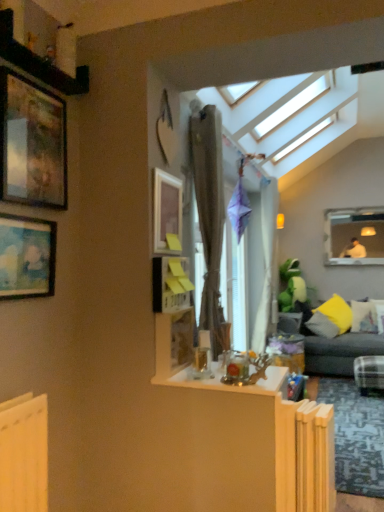
Where is `matte wooden picture frame at upper left, which is counted as the 4th picture frame, starting from the right`? matte wooden picture frame at upper left, which is counted as the 4th picture frame, starting from the right is located at coordinates (26, 257).

This screenshot has height=512, width=384. Describe the element at coordinates (331, 318) in the screenshot. I see `yellow fabric pillow at right, the second pillow viewed from the right` at that location.

Where is `matte wooden picture frame at upper center, placed as the third picture frame when sorted from left to right`? This screenshot has width=384, height=512. matte wooden picture frame at upper center, placed as the third picture frame when sorted from left to right is located at coordinates (166, 208).

Where is `wooden radiator at lower right`? The width and height of the screenshot is (384, 512). wooden radiator at lower right is located at coordinates (305, 456).

Image resolution: width=384 pixels, height=512 pixels. Describe the element at coordinates (305, 456) in the screenshot. I see `wooden radiator at lower right` at that location.

The height and width of the screenshot is (512, 384). I want to click on clear glass table at center, so click(x=233, y=384).

Locate an element on the screen. matte wooden picture frame at upper left, the 1th picture frame in the left-to-right sequence is located at coordinates (26, 257).

This screenshot has width=384, height=512. Find the location of `the 2nd picture frame in front of the wooden radiator at lower right`. the 2nd picture frame in front of the wooden radiator at lower right is located at coordinates (26, 257).

Relative to matte wooden picture frame at upper left, the 1th picture frame in the left-to-right sequence, is wooden radiator at lower right in front or behind?

In the image, wooden radiator at lower right appears behind matte wooden picture frame at upper left, the 1th picture frame in the left-to-right sequence.

Would you say wooden radiator at lower right is a long distance from matte wooden picture frame at upper left, the 1th picture frame in the left-to-right sequence?

Yes, wooden radiator at lower right is far from matte wooden picture frame at upper left, the 1th picture frame in the left-to-right sequence.

Can you tell me how much wooden radiator at lower right and matte wooden picture frame at upper left, which is counted as the 4th picture frame, starting from the right, differ in facing direction?

They differ by 0.505 degrees in their facing directions.

Which object is further away from the camera taking this photo, yellow fabric pillow at right, the 3th pillow viewed from the left, or brown textured curtain at center?

yellow fabric pillow at right, the 3th pillow viewed from the left, is more distant.

Does yellow fabric pillow at right, arranged as the 1th pillow when viewed from the right, have a lesser height compared to brown textured curtain at center?

Correct, yellow fabric pillow at right, arranged as the 1th pillow when viewed from the right, is not as tall as brown textured curtain at center.

Is matte white frame at upper right, which ranks as the first window frame in right-to-left order, at the left side of matte wooden picture frame at upper left, which is counted as the 4th picture frame, starting from the right?

In fact, matte white frame at upper right, which ranks as the first window frame in right-to-left order, is to the right of matte wooden picture frame at upper left, which is counted as the 4th picture frame, starting from the right.

Considering the relative sizes of matte white frame at upper right, which ranks as the first window frame in right-to-left order, and matte wooden picture frame at upper left, which is counted as the 4th picture frame, starting from the right, in the image provided, is matte white frame at upper right, which ranks as the first window frame in right-to-left order, taller than matte wooden picture frame at upper left, which is counted as the 4th picture frame, starting from the right,?

Yes, matte white frame at upper right, which ranks as the first window frame in right-to-left order, is taller than matte wooden picture frame at upper left, which is counted as the 4th picture frame, starting from the right.

From a real-world perspective, is matte white frame at upper right, which ranks as the first window frame in right-to-left order, above or below matte wooden picture frame at upper left, the 1th picture frame in the left-to-right sequence?

Clearly, from a real-world perspective, matte white frame at upper right, which ranks as the first window frame in right-to-left order, is above matte wooden picture frame at upper left, the 1th picture frame in the left-to-right sequence.

Is matte wooden picture frame at upper left, the second picture frame positioned from the bottom, at the back of matte white frame at upper right, which ranks as the first window frame in right-to-left order?

No, matte white frame at upper right, which ranks as the first window frame in right-to-left order,'s orientation is not away from matte wooden picture frame at upper left, the second picture frame positioned from the bottom.

From the picture: Is yellow fabric pillow at right, the 3th pillow viewed from the left, outside of wooden picture frame at center, positioned as the first picture frame in right-to-left order?

Absolutely, yellow fabric pillow at right, the 3th pillow viewed from the left, is external to wooden picture frame at center, positioned as the first picture frame in right-to-left order.

How much distance is there between yellow fabric pillow at right, arranged as the 1th pillow when viewed from the right, and wooden picture frame at center, which ranks as the first picture frame in bottom-to-top order?

yellow fabric pillow at right, arranged as the 1th pillow when viewed from the right, is 3.80 meters from wooden picture frame at center, which ranks as the first picture frame in bottom-to-top order.

Considering the positions of points (370, 309) and (177, 356), is point (370, 309) farther from camera compared to point (177, 356)?

That is True.

Is yellow fabric pillow at right, the 3th pillow viewed from the left, closer to camera compared to wooden picture frame at center, which ranks as the first picture frame in bottom-to-top order?

No, it is behind wooden picture frame at center, which ranks as the first picture frame in bottom-to-top order.

From the image's perspective, would you say purple paper origami at center, arranged as the 2th window frame when viewed from the right, is shown under matte wooden picture frame at upper center, positioned as the third picture frame in bottom-to-top order?

Yes, from the image's perspective, purple paper origami at center, arranged as the 2th window frame when viewed from the right, is beneath matte wooden picture frame at upper center, positioned as the third picture frame in bottom-to-top order.

Is point (222, 289) closer or farther from the camera than point (172, 227)?

Point (222, 289) is positioned farther from the camera compared to point (172, 227).

Does purple paper origami at center, which appears as the 2th window frame when viewed from the back, have a lesser height compared to matte wooden picture frame at upper center, placed as the third picture frame when sorted from left to right?

Incorrect, the height of purple paper origami at center, which appears as the 2th window frame when viewed from the back, does not fall short of that of matte wooden picture frame at upper center, placed as the third picture frame when sorted from left to right.

From a real-world perspective, is yellow fabric pillow at right, the second pillow viewed from the right, positioned above or below brown textured curtain at center?

yellow fabric pillow at right, the second pillow viewed from the right, is below brown textured curtain at center.

Is brown textured curtain at center completely or partially inside yellow fabric pillow at right, the second pillow viewed from the right?

No, yellow fabric pillow at right, the second pillow viewed from the right, does not contain brown textured curtain at center.

Would you say yellow fabric pillow at right, marked as the second pillow in a left-to-right arrangement, is to the left or to the right of brown textured curtain at center in the picture?

yellow fabric pillow at right, marked as the second pillow in a left-to-right arrangement, is positioned on brown textured curtain at center's right side.

Is matte wooden picture frame at upper left, positioned as the third picture frame in right-to-left order, taller or shorter than wooden picture frame at center, arranged as the 4th picture frame when viewed from the left?

In the image, matte wooden picture frame at upper left, positioned as the third picture frame in right-to-left order, appears to be taller than wooden picture frame at center, arranged as the 4th picture frame when viewed from the left.

From the picture: From a real-world perspective, between matte wooden picture frame at upper left, the 1th picture frame in the top-to-bottom sequence, and wooden picture frame at center, positioned as the first picture frame in right-to-left order, who is vertically lower?

In real-world perspective, wooden picture frame at center, positioned as the first picture frame in right-to-left order, is lower.

From the image's perspective, is matte wooden picture frame at upper left, which ranks as the second picture frame in left-to-right order, above or below wooden picture frame at center, marked as the fourth picture frame in a top-to-bottom arrangement?

Based on their image positions, matte wooden picture frame at upper left, which ranks as the second picture frame in left-to-right order, is located above wooden picture frame at center, marked as the fourth picture frame in a top-to-bottom arrangement.

Locate an element on the screen. The width and height of the screenshot is (384, 512). the 1st picture frame in front when counting from the wooden picture frame at center, positioned as the first picture frame in right-to-left order is located at coordinates [x=32, y=143].

Which picture frame is the 2nd one when counting from the front of the wooden radiator at lower right? Please provide its 2D coordinates.

[(26, 257)]

Starting from the brown textured curtain at center, which pillow is the 3rd one to the right? Please provide its 2D coordinates.

[(364, 316)]

From the image, which object appears to be farther from clear glass table at center, yellow fabric pillow at right, which appears as the 1th pillow when viewed from the left, or dark gray fabric couch at right?

Among the two, yellow fabric pillow at right, which appears as the 1th pillow when viewed from the left, is located further to clear glass table at center.

Looking at the image, which one is located closer to yellow fabric pillow at right, the second pillow viewed from the right, dark gray fabric couch at right or yellow fabric pillow at right, the 3th pillow viewed from the left?

The object closer to yellow fabric pillow at right, the second pillow viewed from the right, is dark gray fabric couch at right.

When comparing their distances from purple paper origami at center, which appears as the 2th window frame when viewed from the back, does matte white frame at upper right, acting as the 1th window frame starting from the back, or yellow fabric pillow at right, marked as the second pillow in a left-to-right arrangement, seem closer?

yellow fabric pillow at right, marked as the second pillow in a left-to-right arrangement, is positioned closer to the anchor purple paper origami at center, which appears as the 2th window frame when viewed from the back.

Estimate the real-world distances between objects in this image. Which object is further from yellow fabric pillow at right, which is counted as the 3th pillow, starting from the right, brown textured curtain at center or yellow fabric pillow at right, arranged as the 1th pillow when viewed from the right?

Based on the image, brown textured curtain at center appears to be further to yellow fabric pillow at right, which is counted as the 3th pillow, starting from the right.

Consider the image. From the image, which object appears to be nearer to yellow fabric pillow at right, marked as the second pillow in a left-to-right arrangement, wooden picture frame at center, marked as the fourth picture frame in a top-to-bottom arrangement, or matte wooden picture frame at upper left, which ranks as the second picture frame in left-to-right order?

wooden picture frame at center, marked as the fourth picture frame in a top-to-bottom arrangement, is positioned closer to the anchor yellow fabric pillow at right, marked as the second pillow in a left-to-right arrangement.

When comparing their distances from yellow fabric pillow at right, the 3th pillow viewed from the left, does purple paper origami at center, arranged as the 2th window frame when viewed from the right, or matte white frame at upper right, which ranks as the first window frame in right-to-left order, seem closer?

Among the two, matte white frame at upper right, which ranks as the first window frame in right-to-left order, is located nearer to yellow fabric pillow at right, the 3th pillow viewed from the left.

Looking at the image, which one is located closer to yellow fabric pillow at right, the second pillow viewed from the right, matte wooden picture frame at upper center, positioned as the third picture frame in bottom-to-top order, or clear glass table at center?

clear glass table at center lies closer to yellow fabric pillow at right, the second pillow viewed from the right, than the other object.

From the image, which object appears to be nearer to matte wooden picture frame at upper center, marked as the 2th picture frame in a right-to-left arrangement, wooden radiator at lower right or yellow fabric pillow at right, arranged as the 1th pillow when viewed from the right?

The object closer to matte wooden picture frame at upper center, marked as the 2th picture frame in a right-to-left arrangement, is wooden radiator at lower right.

At what (x,y) coordinates should I click in order to perform the action: click on curtain between wooden picture frame at center, marked as the fourth picture frame in a top-to-bottom arrangement, and yellow fabric pillow at right, arranged as the 1th pillow when viewed from the right, from front to back. Please return your answer as a coordinate pair (x, y). Looking at the image, I should click on (209, 213).

Locate an element on the screen. window frame positioned between matte wooden picture frame at upper center, positioned as the third picture frame in bottom-to-top order, and dark gray fabric couch at right from near to far is located at coordinates (234, 286).

Locate an element on the screen. curtain between matte wooden picture frame at upper left, positioned as the third picture frame in right-to-left order, and purple paper origami at center, which appears as the 2th window frame when viewed from the back, from front to back is located at coordinates (209, 213).

You are a GUI agent. You are given a task and a screenshot of the screen. Output one action in this format:
    pyautogui.click(x=<x>, y=<y>)
    Task: Click on the window frame between wooden radiator at lower right and yellow fabric pillow at right, marked as the second pillow in a left-to-right arrangement, from front to back
    Image resolution: width=384 pixels, height=512 pixels.
    Given the screenshot: What is the action you would take?
    pyautogui.click(x=234, y=286)